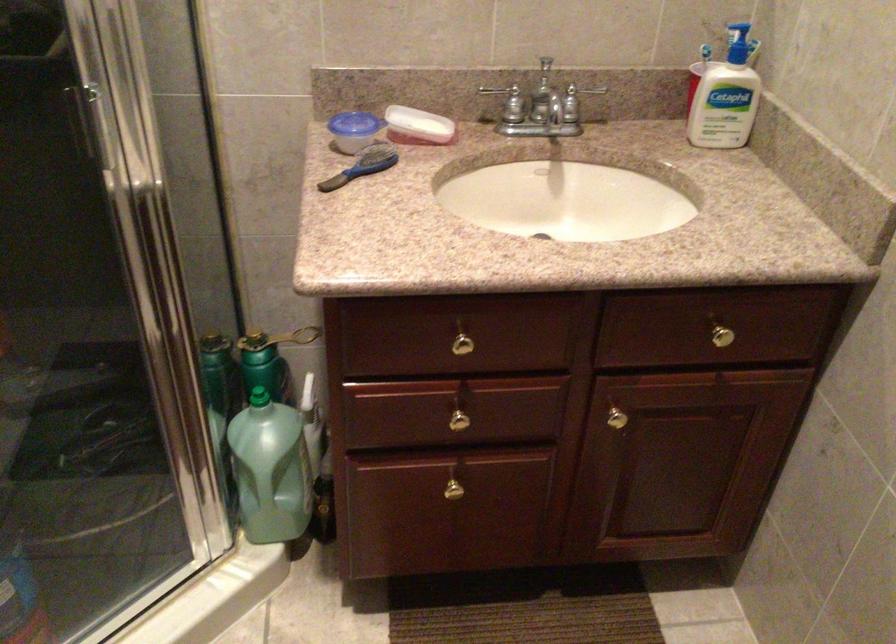
Where is `blue container lid`? The height and width of the screenshot is (644, 896). blue container lid is located at coordinates (343, 126).